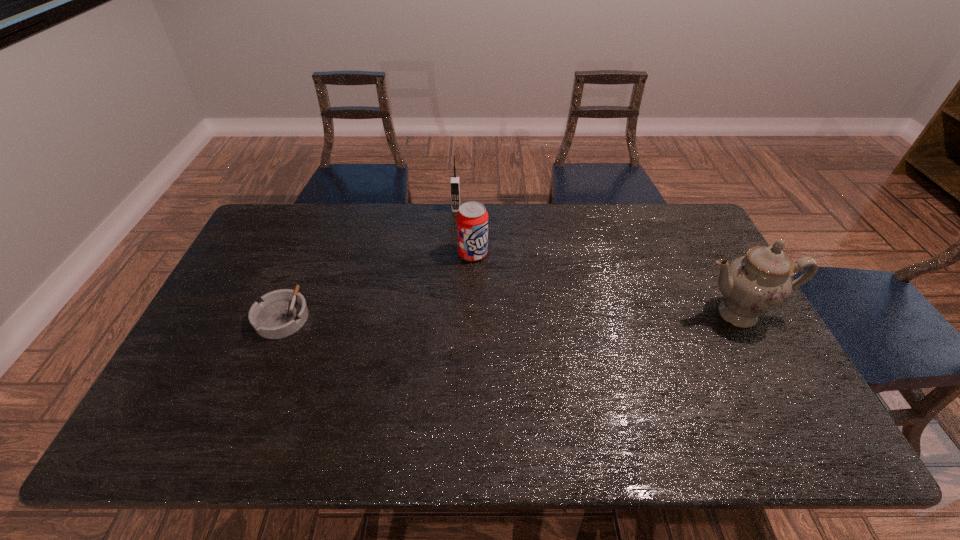
Identify the location of the shortest object. (281, 313).

Find the location of a particular element. The image size is (960, 540). the leftmost object is located at coordinates (281, 313).

At what (x,y) coordinates should I click in order to perform the action: click on the rightmost object. Please return your answer as a coordinate pair (x, y). The width and height of the screenshot is (960, 540). Looking at the image, I should click on (754, 284).

What are the coordinates of `chinaware` in the screenshot? It's located at (754, 284).

Find the location of a particular element. soda can is located at coordinates (472, 218).

The image size is (960, 540). Find the location of `the third nearest object`. the third nearest object is located at coordinates (472, 218).

You are a GUI agent. You are given a task and a screenshot of the screen. Output one action in this format:
    pyautogui.click(x=<x>, y=<y>)
    Task: Click on the third object from right to left
    
    Given the screenshot: What is the action you would take?
    pyautogui.click(x=455, y=181)

Find the location of `the farthest object`. the farthest object is located at coordinates (455, 181).

Identify the location of vacant space located 0.270m on the right of the shortest object. (404, 317).

I want to click on free space located on the spout of the chinaware, so click(x=787, y=406).